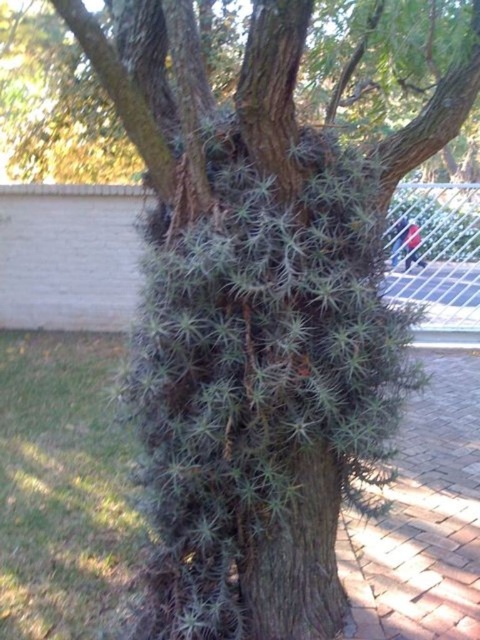
Question: Does green spiky plant at center appear over metallic chain-link fence at upper center?

Choices:
 (A) yes
 (B) no

Answer: (B)

Question: Is the position of green spiky plant at center less distant than that of metallic chain-link fence at upper center?

Choices:
 (A) yes
 (B) no

Answer: (A)

Question: Is green spiky plant at center behind metallic chain-link fence at upper center?

Choices:
 (A) yes
 (B) no

Answer: (B)

Question: Among these objects, which one is nearest to the camera?

Choices:
 (A) green spiky plant at center
 (B) metallic chain-link fence at upper center

Answer: (A)